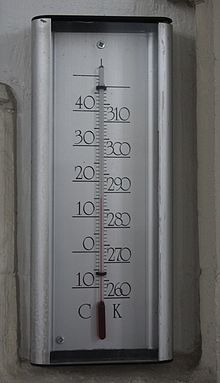
What are the coordinates of `wall` in the screenshot? It's located at (203, 311).